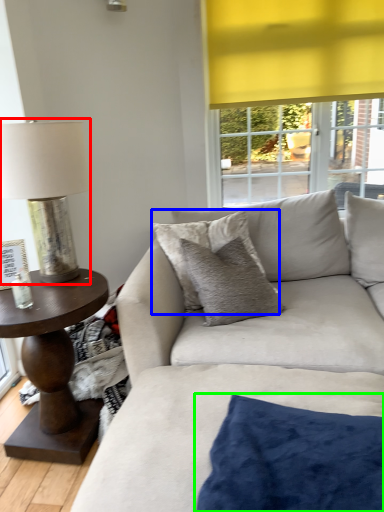
Question: Based on their relative distances, which object is nearer to table lamp (highlighted by a red box)? Choose from pillow (highlighted by a blue box) and pillow (highlighted by a green box).

Choices:
 (A) pillow
 (B) pillow

Answer: (A)